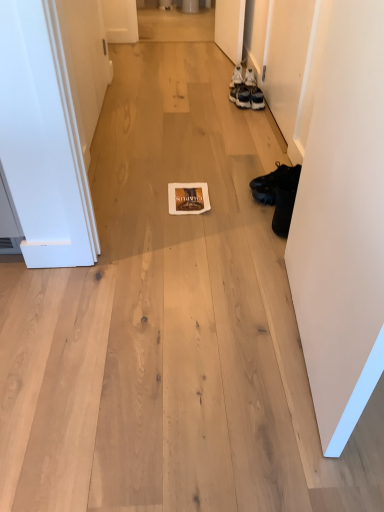
Question: Is white painted wood door at left, the 1th door positioned from the left, not inside matte black sneakers at upper right, marked as the 2th footwear in a back-to-front arrangement?

Choices:
 (A) yes
 (B) no

Answer: (A)

Question: Would you say white painted wood door at left, which appears as the second door when ordered from the bottom, contains matte black sneakers at upper right, which is the 2th footwear from top to bottom?

Choices:
 (A) no
 (B) yes

Answer: (A)

Question: Does white painted wood door at left, marked as the first door in a back-to-front arrangement, have a greater height compared to matte black sneakers at upper right, which is the 3th footwear from bottom to top?

Choices:
 (A) yes
 (B) no

Answer: (A)

Question: Does white painted wood door at left, which is counted as the first door, starting from the top, have a lesser width compared to matte black sneakers at upper right, which is the 3th footwear from bottom to top?

Choices:
 (A) no
 (B) yes

Answer: (B)

Question: Is white painted wood door at left, the second door viewed from the right, smaller than matte black sneakers at upper right, which is the third footwear from front to back?

Choices:
 (A) yes
 (B) no

Answer: (B)

Question: Can you confirm if white painted wood door at left, marked as the first door in a back-to-front arrangement, is bigger than matte black sneakers at upper right, marked as the 2th footwear in a back-to-front arrangement?

Choices:
 (A) yes
 (B) no

Answer: (A)

Question: Does matte brown magazine at center contain white leather sneakers at upper right, acting as the 1th footwear starting from the top?

Choices:
 (A) no
 (B) yes

Answer: (A)

Question: Is matte brown magazine at center with white leather sneakers at upper right, acting as the 1th footwear starting from the top?

Choices:
 (A) no
 (B) yes

Answer: (A)

Question: Does matte brown magazine at center turn towards white leather sneakers at upper right, the 4th footwear ordered from the bottom?

Choices:
 (A) no
 (B) yes

Answer: (A)

Question: Is matte brown magazine at center looking in the opposite direction of white leather sneakers at upper right, which ranks as the 1th footwear in back-to-front order?

Choices:
 (A) yes
 (B) no

Answer: (B)

Question: Does matte brown magazine at center have a lesser height compared to white leather sneakers at upper right, acting as the 1th footwear starting from the top?

Choices:
 (A) yes
 (B) no

Answer: (A)

Question: Is matte brown magazine at center positioned before white leather sneakers at upper right, the 4th footwear ordered from the bottom?

Choices:
 (A) no
 (B) yes

Answer: (B)

Question: From a real-world perspective, is white matte door at right, arranged as the second door when viewed from the top, positioned over white leather sneakers at upper right, acting as the 1th footwear starting from the top, based on gravity?

Choices:
 (A) no
 (B) yes

Answer: (B)